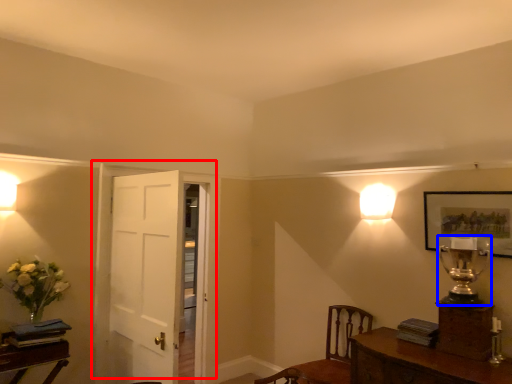
Question: Which object appears farthest to the camera in this image, door (highlighted by a red box) or table lamp (highlighted by a blue box)?

Choices:
 (A) door
 (B) table lamp

Answer: (A)